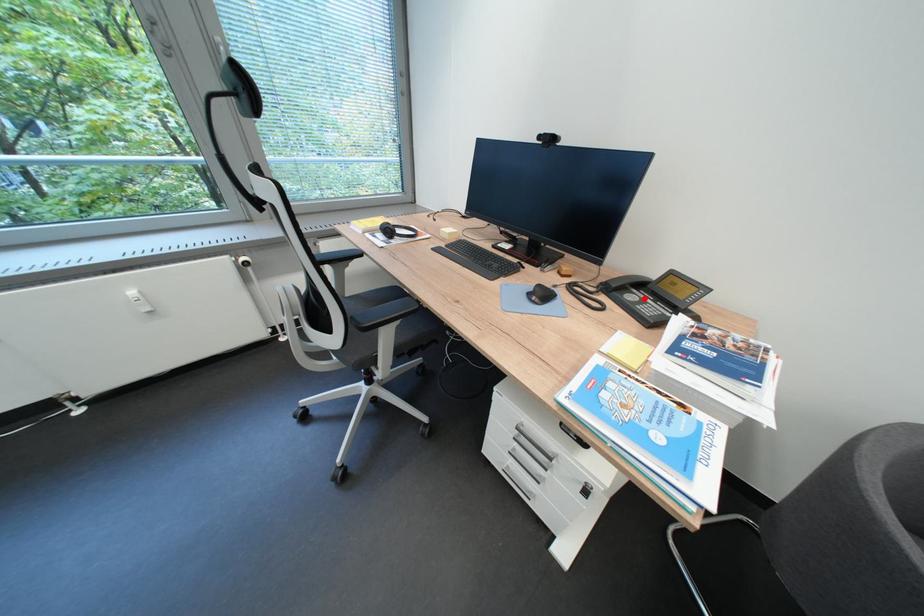
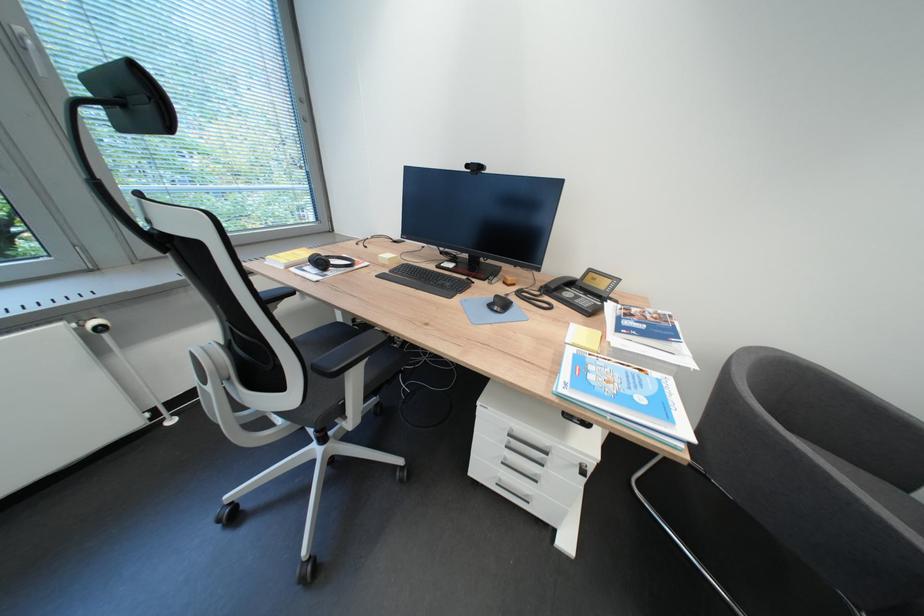
Locate, in the second image, the point that corresponds to the highlighted location in the first image.

(580, 294)